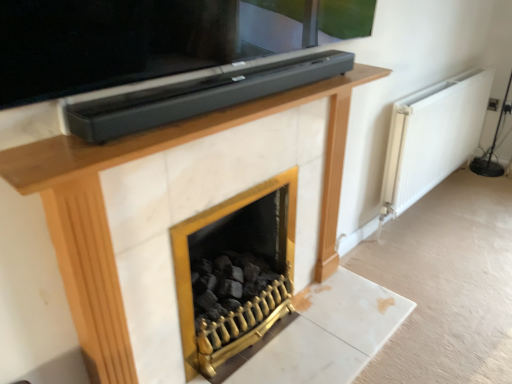
Question: Is gold metallic fireplace at center not near white matte radiator at right?

Choices:
 (A) yes
 (B) no

Answer: (A)

Question: From the image's perspective, is gold metallic fireplace at center below white matte radiator at right?

Choices:
 (A) yes
 (B) no

Answer: (A)

Question: Is gold metallic fireplace at center to the right of white matte radiator at right from the viewer's perspective?

Choices:
 (A) no
 (B) yes

Answer: (A)

Question: Does gold metallic fireplace at center have a smaller size compared to white matte radiator at right?

Choices:
 (A) no
 (B) yes

Answer: (B)

Question: Is gold metallic fireplace at center oriented towards white matte radiator at right?

Choices:
 (A) yes
 (B) no

Answer: (B)

Question: Is gold metallic fireplace at center thinner than white matte radiator at right?

Choices:
 (A) no
 (B) yes

Answer: (A)

Question: Can you confirm if white matte radiator at right is positioned to the right of gold metallic fireplace at center?

Choices:
 (A) no
 (B) yes

Answer: (B)

Question: From the image's perspective, would you say white matte radiator at right is positioned over gold metallic fireplace at center?

Choices:
 (A) no
 (B) yes

Answer: (B)

Question: Is the depth of white matte radiator at right greater than that of gold metallic fireplace at center?

Choices:
 (A) yes
 (B) no

Answer: (A)

Question: Can you confirm if white matte radiator at right is taller than gold metallic fireplace at center?

Choices:
 (A) yes
 (B) no

Answer: (A)

Question: Is white matte radiator at right placed right next to gold metallic fireplace at center?

Choices:
 (A) yes
 (B) no

Answer: (B)

Question: Can you confirm if white matte radiator at right is thinner than gold metallic fireplace at center?

Choices:
 (A) no
 (B) yes

Answer: (B)

Question: From their relative heights in the image, would you say gold metallic fireplace at center is taller or shorter than white matte radiator at right?

Choices:
 (A) tall
 (B) short

Answer: (B)